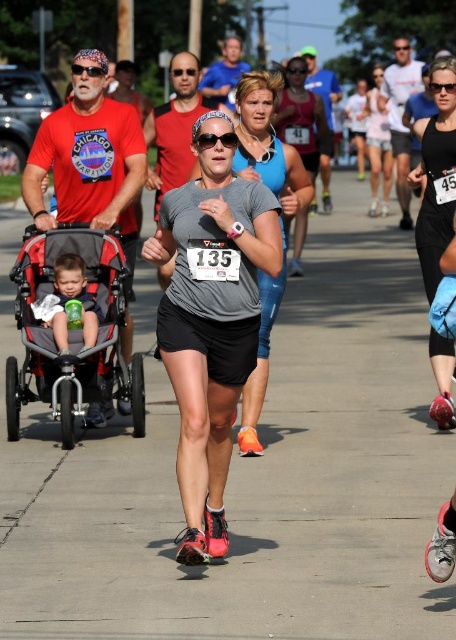
Question: Which of the following is the closest to the observer?

Choices:
 (A) (435, 150)
 (B) (371, 156)
 (C) (136, 426)
 (D) (253, 390)

Answer: (D)

Question: Can you confirm if gray matte tank top at center is smaller than matte black shorts at center?

Choices:
 (A) yes
 (B) no

Answer: (B)

Question: Is gray fabric stroller at left bigger than gray matte tank top at center?

Choices:
 (A) yes
 (B) no

Answer: (A)

Question: Which of the following is the farthest from the observer?

Choices:
 (A) (447, 140)
 (B) (269, 168)
 (C) (372, 172)
 (D) (231, 333)

Answer: (C)

Question: Which of the following is the farthest from the observer?

Choices:
 (A) (384, 205)
 (B) (217, 192)

Answer: (A)

Question: Can you confirm if gray matte running shoe at center is wider than matte blue tank top at center?

Choices:
 (A) yes
 (B) no

Answer: (A)